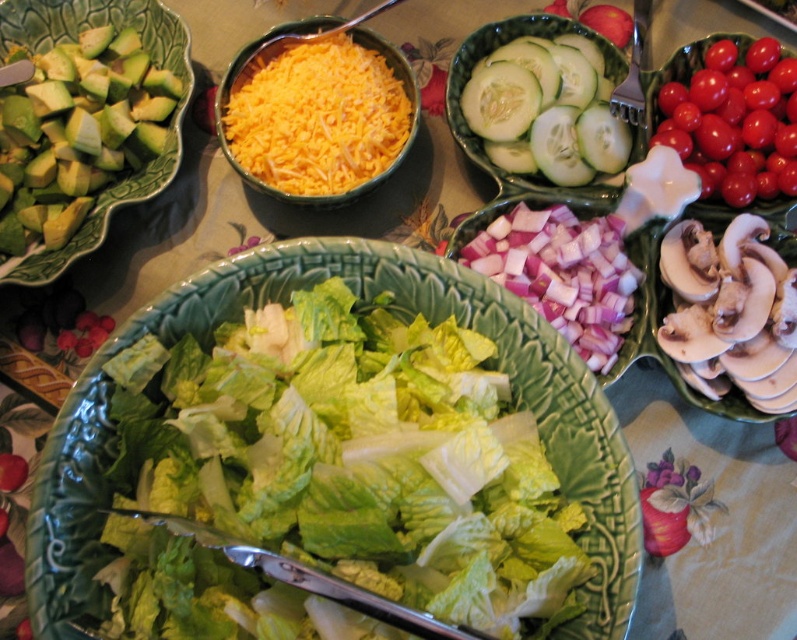
Question: Can you confirm if green leafy lettuce at center is wider than green ceramic bowl at upper left?

Choices:
 (A) no
 (B) yes

Answer: (B)

Question: Which object appears farthest from the camera in this image?

Choices:
 (A) green smooth cucumber at center
 (B) green ceramic bowl at upper left

Answer: (A)

Question: Considering the real-world distances, which object is farthest from the yellow shredded cheese at center?

Choices:
 (A) green smooth cucumber at center
 (B) green leafy lettuce at center
 (C) pink translucent onion at center
 (D) glossy cherry tomatoes at upper right

Answer: (D)

Question: Does green leafy lettuce at center appear on the right side of pink translucent onion at center?

Choices:
 (A) no
 (B) yes

Answer: (A)

Question: Does green smooth cucumber at center have a greater width compared to yellow shredded cheese at center?

Choices:
 (A) yes
 (B) no

Answer: (B)

Question: Which of the following is the closest to the observer?

Choices:
 (A) (205, 538)
 (B) (688, 164)
 (C) (572, 269)

Answer: (A)